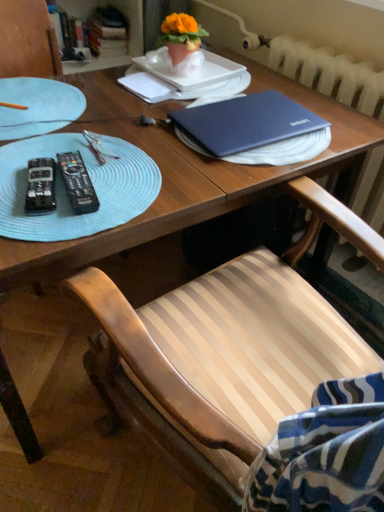
Locate an element on the screen. The image size is (384, 512). spots to the right of black plastic remote control at left, which appears as the 1th remote control when viewed from the left is located at coordinates (132, 187).